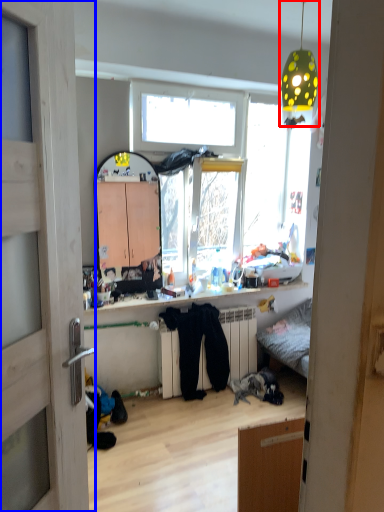
Question: Among these objects, which one is farthest to the camera, light fixture (highlighted by a red box) or door (highlighted by a blue box)?

Choices:
 (A) light fixture
 (B) door

Answer: (A)